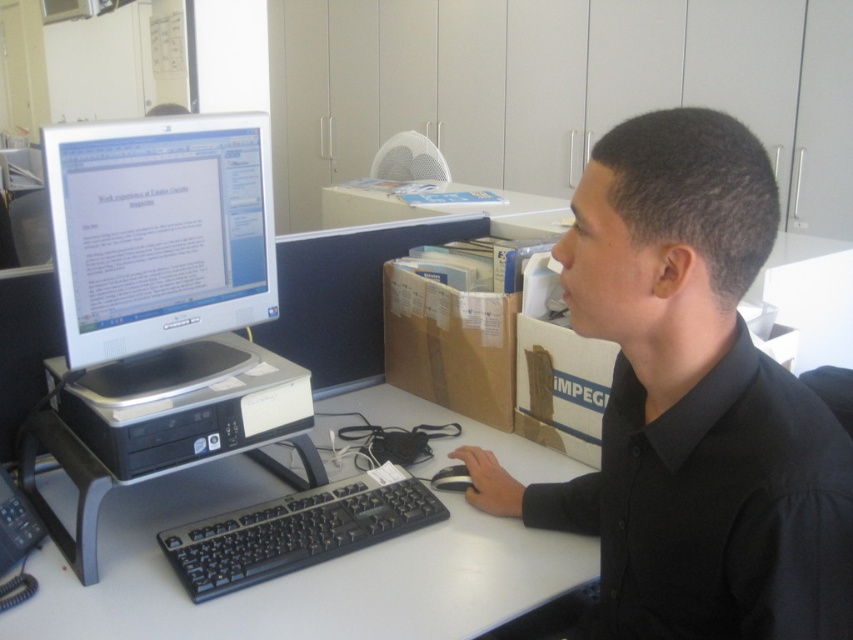
Question: Which of the following is the farthest from the observer?

Choices:
 (A) (181, 564)
 (B) (469, 483)

Answer: (B)

Question: Which object is the farthest from the black plastic computer desk at center?

Choices:
 (A) black rubber mouse at center
 (B) black matte keyboard at center
 (C) white glossy monitor at center
 (D) black matte shirt at center

Answer: (C)

Question: Is white glossy monitor at center bigger than black rubber mouse at center?

Choices:
 (A) no
 (B) yes

Answer: (B)

Question: Which point is farther from the camera taking this photo?

Choices:
 (A) pos(747,531)
 (B) pos(488,586)
 (C) pos(440,481)
 (D) pos(403,492)

Answer: (C)

Question: Does black matte shirt at center appear over black matte keyboard at center?

Choices:
 (A) no
 (B) yes

Answer: (B)

Question: Can you confirm if black matte shirt at center is positioned below black rubber mouse at center?

Choices:
 (A) yes
 (B) no

Answer: (B)